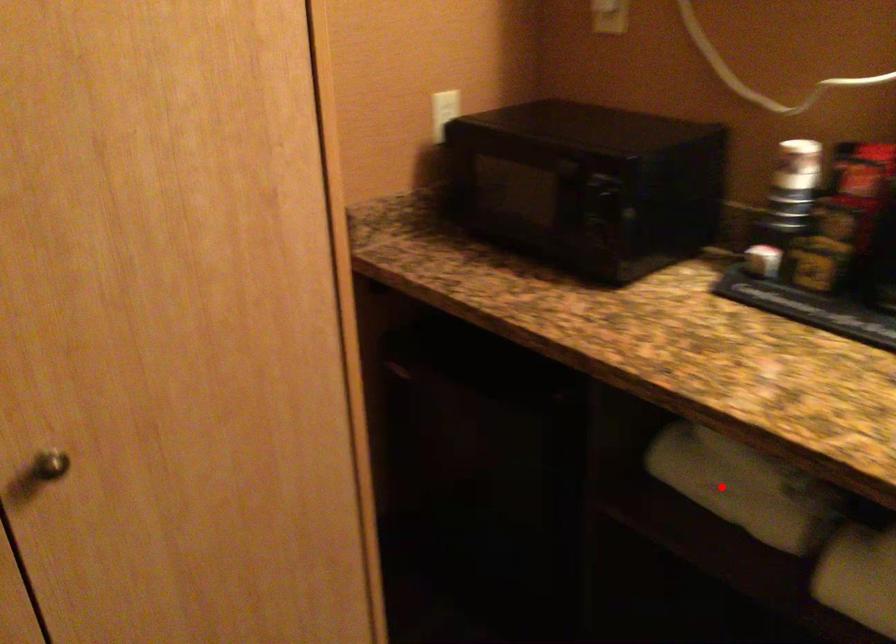
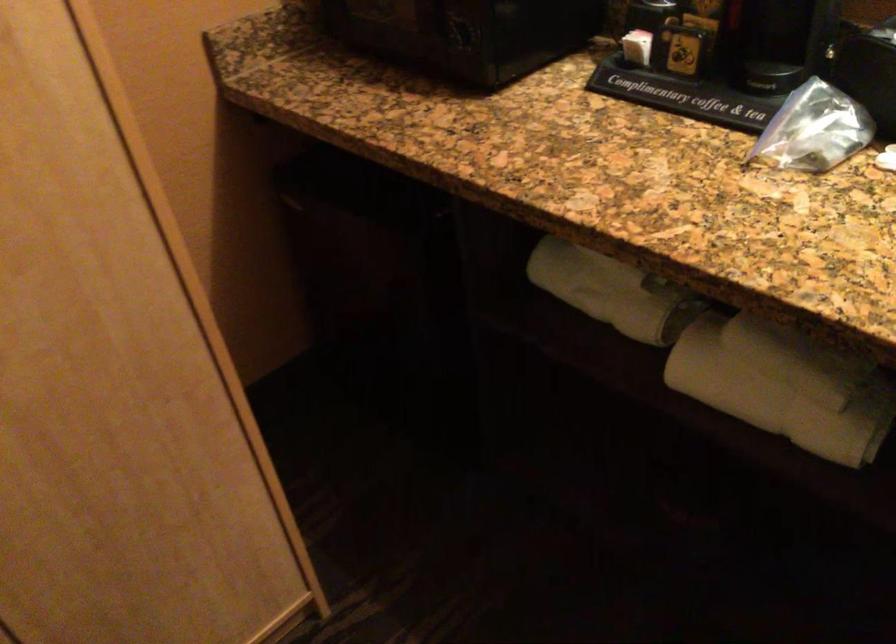
Question: I am providing you with two images of the same scene from different viewpoints. A red point is marked on the first image. Can you still see the location of the red point in image 2?

Choices:
 (A) Yes
 (B) No

Answer: (A)